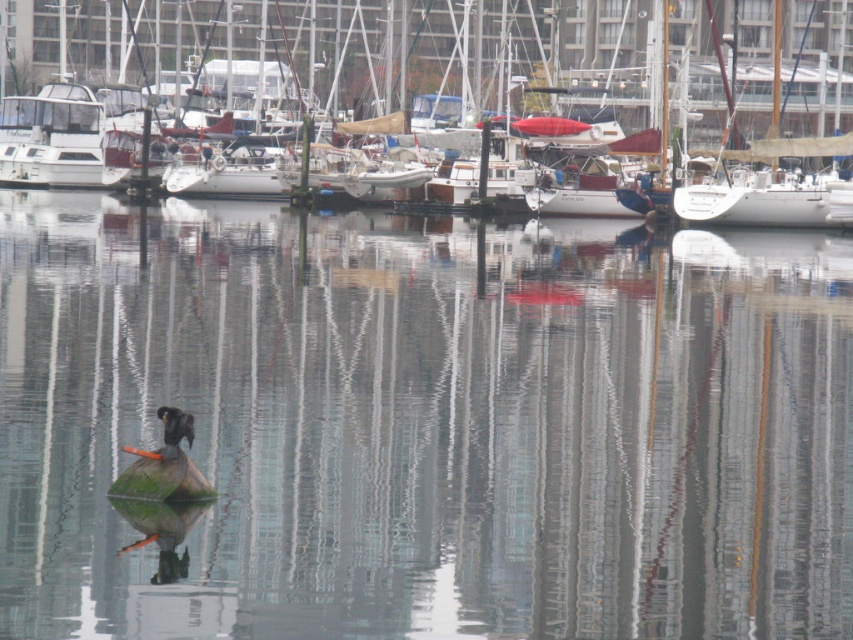
You are a drone operator tasked with capturing aerial footage of the marina. You need to ensure that the camera is positioned to avoid any obstructions. Based on the scene, is the point at coordinates point (422, 426) unobstructed? Please refer to the scene description for context.

The point at coordinates point (422, 426) is clear water at center, so there are no obstructions at that location. The camera can be positioned there without any issues.